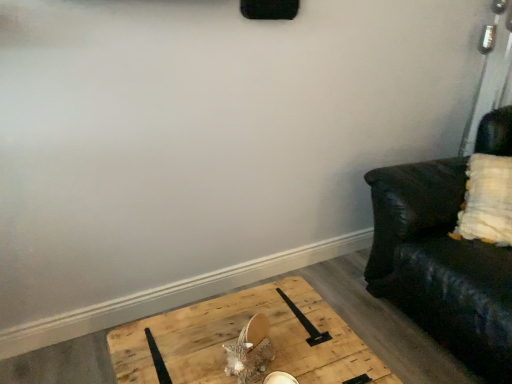
Find the location of a particular element. blank space situated above wooden pallet at lower center (from a real-world perspective) is located at coordinates (268, 336).